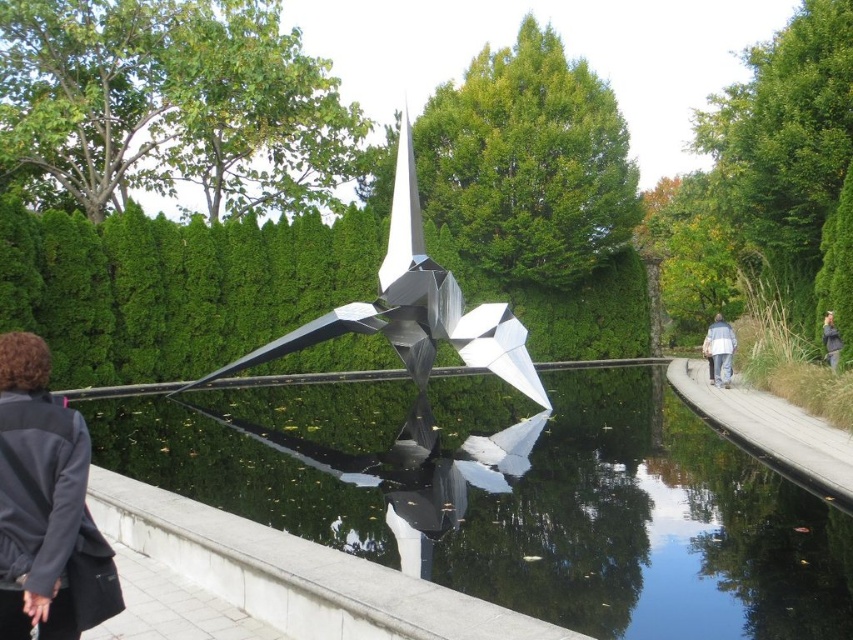
Does point (445, 284) come behind point (825, 355)?

No, (445, 284) is closer to viewer.

This screenshot has width=853, height=640. I want to click on metallic silver sculpture at center, so click(415, 307).

Can you confirm if transparent glass water at center is wider than metallic silver sculpture at center?

Correct, the width of transparent glass water at center exceeds that of metallic silver sculpture at center.

Does transparent glass water at center lie behind metallic silver sculpture at center?

No, transparent glass water at center is in front of metallic silver sculpture at center.

Locate an element on the screen. transparent glass water at center is located at coordinates (477, 509).

Is transparent glass water at center thinner than gray fabric jacket at upper right?

In fact, transparent glass water at center might be wider than gray fabric jacket at upper right.

Does transparent glass water at center have a greater width compared to gray fabric jacket at upper right?

Yes.

This screenshot has width=853, height=640. Find the location of `transparent glass water at center`. transparent glass water at center is located at coordinates (477, 509).